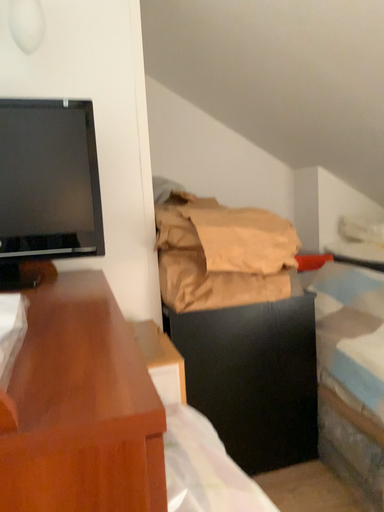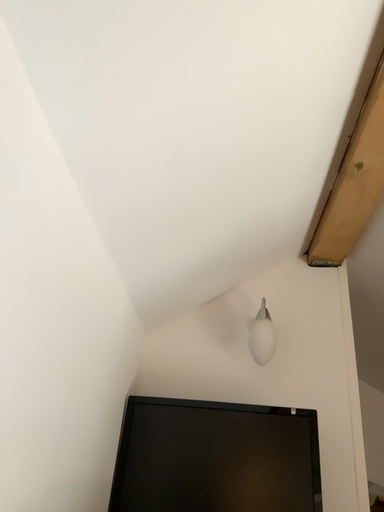
Question: How did the camera likely rotate when shooting the video?

Choices:
 (A) rotated upward
 (B) rotated downward

Answer: (A)